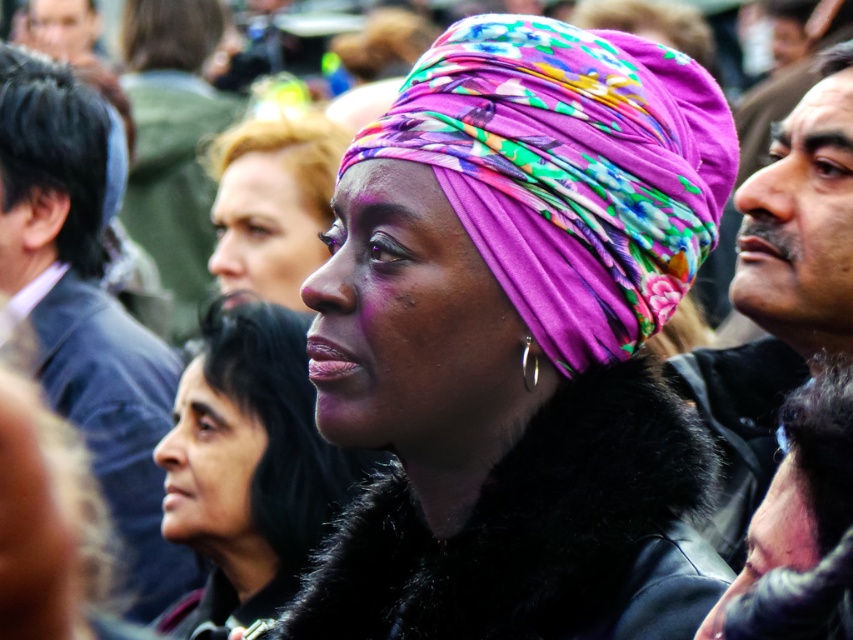
Measure the distance between smooth skin face at right and camera.

A distance of 22.26 meters exists between smooth skin face at right and camera.

Can you confirm if smooth skin face at right is positioned to the right of matte black hair at upper center?

Yes, smooth skin face at right is to the right of matte black hair at upper center.

Looking at this image, who is more distant from viewer, (798, 140) or (236, 259)?

The point (236, 259) is more distant.

Find the location of a particular element. smooth skin face at right is located at coordinates (799, 220).

Who is shorter, matte black fur coat at center or matte black hair at upper center?

matte black hair at upper center is shorter.

Is matte black fur coat at center shorter than matte black hair at upper center?

Incorrect, matte black fur coat at center's height does not fall short of matte black hair at upper center's.

What do you see at coordinates (248, 467) in the screenshot? Image resolution: width=853 pixels, height=640 pixels. I see `matte black fur coat at center` at bounding box center [248, 467].

This screenshot has width=853, height=640. I want to click on matte black fur coat at center, so click(248, 467).

Can you confirm if dark brown suit at left is thinner than matte black hair at upper center?

Yes, dark brown suit at left is thinner than matte black hair at upper center.

Who is more forward, (79, 362) or (293, 246)?

Point (79, 362) is in front.

Identify the location of dark brown suit at left. (85, 305).